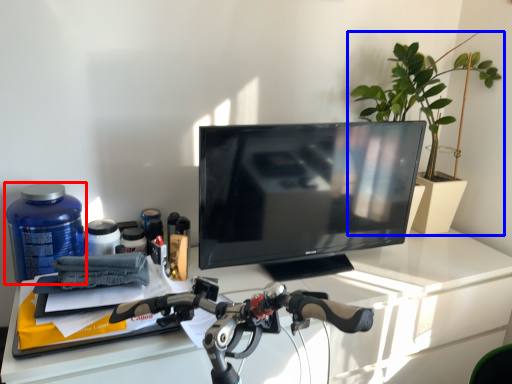
Question: Which of the following is the closest to the observer, bottle (highlighted by a red box) or houseplant (highlighted by a blue box)?

Choices:
 (A) bottle
 (B) houseplant

Answer: (A)